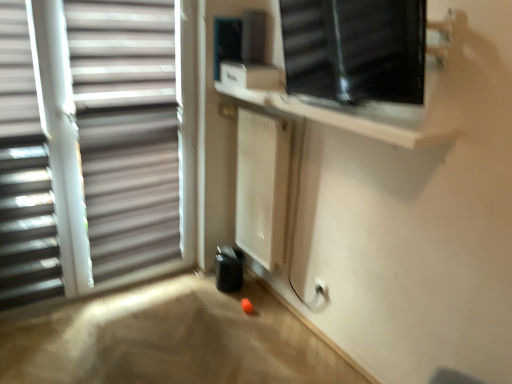
At what (x,y) coordinates should I click in order to perform the action: click on vacant point to the right of white matte window blind at left. Please return your answer as a coordinate pair (x, y). Looking at the image, I should click on (58, 326).